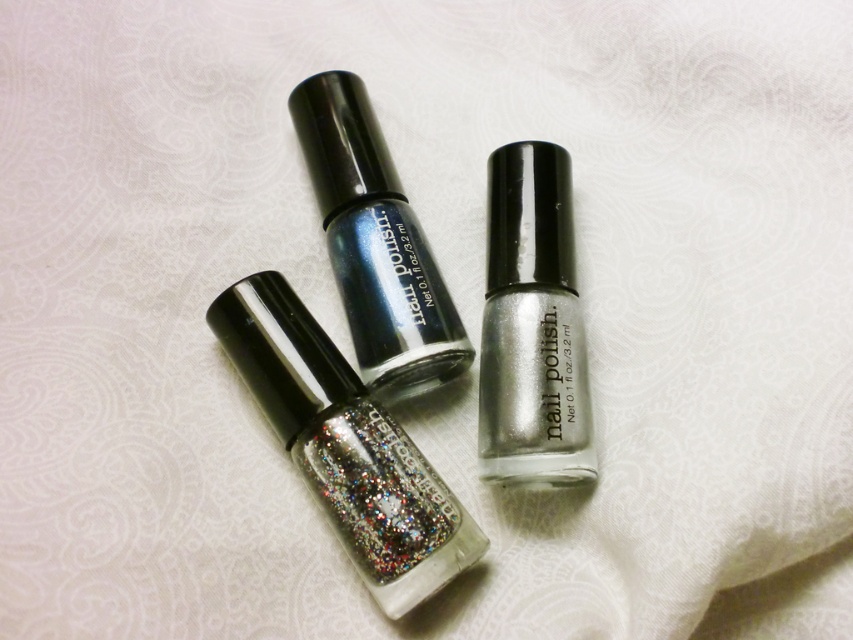
Question: Is glittery silver nail polish at center above silver metallic nail polish at center?

Choices:
 (A) yes
 (B) no

Answer: (B)

Question: Which object is the closest to the silver metallic nail polish at center?

Choices:
 (A) metallic blue nail polish at center
 (B) glittery silver nail polish at center

Answer: (A)

Question: Can you confirm if glittery silver nail polish at center is positioned to the right of silver metallic nail polish at center?

Choices:
 (A) yes
 (B) no

Answer: (B)

Question: Does glittery silver nail polish at center appear over silver metallic nail polish at center?

Choices:
 (A) yes
 (B) no

Answer: (B)

Question: Estimate the real-world distances between objects in this image. Which object is farther from the silver metallic nail polish at center?

Choices:
 (A) glittery silver nail polish at center
 (B) metallic blue nail polish at center

Answer: (A)

Question: Among these points, which one is nearest to the camera?

Choices:
 (A) (431, 317)
 (B) (512, 349)

Answer: (B)